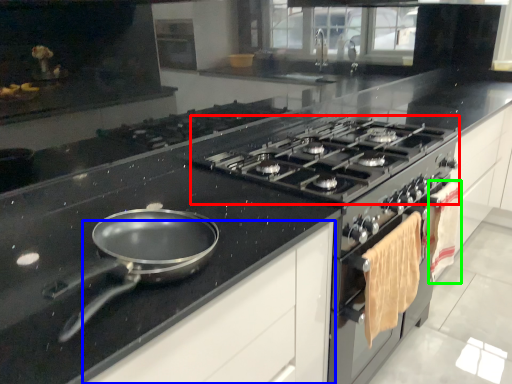
Question: Which object is the farthest from gas stove (highlighted by a red box)? Choose among these: cabinetry (highlighted by a blue box) or material (highlighted by a green box).

Choices:
 (A) cabinetry
 (B) material

Answer: (A)